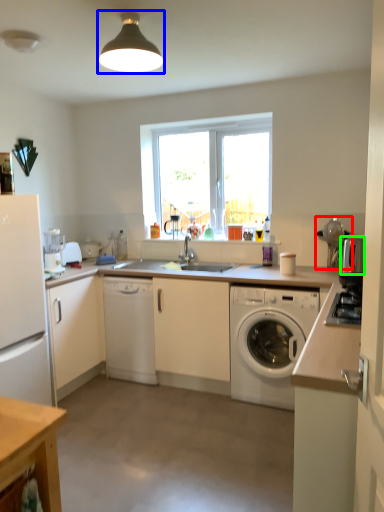
Question: Which object is the closest to the appliance (highlighted by a red box)? Choose among these: light fixture (highlighted by a blue box) or appliance (highlighted by a green box).

Choices:
 (A) light fixture
 (B) appliance

Answer: (B)